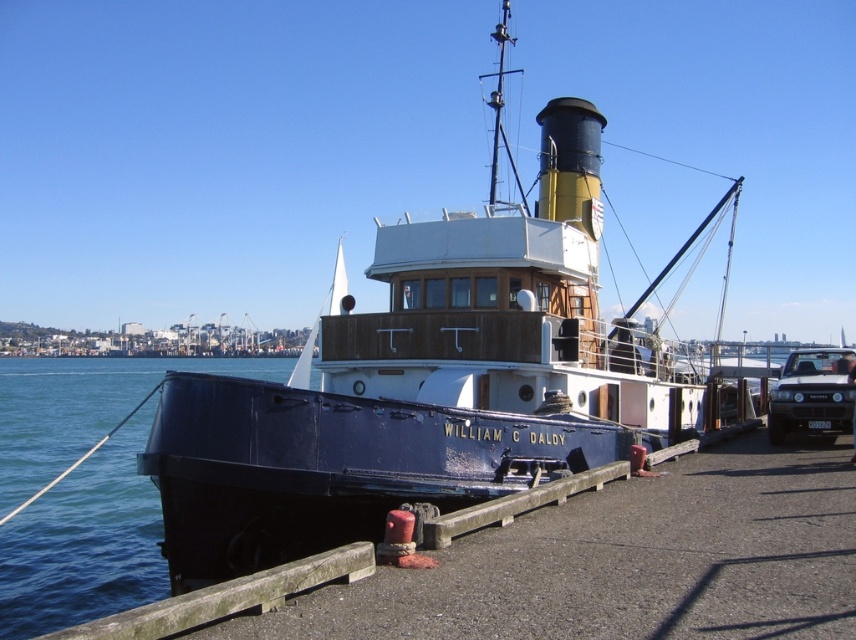
Question: Does blue glossy water at lower left appear on the left side of matte black car at right?

Choices:
 (A) yes
 (B) no

Answer: (A)

Question: Among these objects, which one is nearest to the camera?

Choices:
 (A) matte black car at right
 (B) blue glossy water at lower left
 (C) blue polished wood boat at center

Answer: (C)

Question: Among these points, which one is farthest from the camera?

Choices:
 (A) (134, 497)
 (B) (666, 376)
 (C) (829, 378)

Answer: (A)

Question: Does blue polished wood boat at center have a lesser width compared to matte black car at right?

Choices:
 (A) no
 (B) yes

Answer: (A)

Question: Can you confirm if blue glossy water at lower left is smaller than matte black car at right?

Choices:
 (A) no
 (B) yes

Answer: (A)

Question: Among these points, which one is farthest from the camera?

Choices:
 (A) (819, 410)
 (B) (311, 356)
 (C) (13, 390)

Answer: (C)